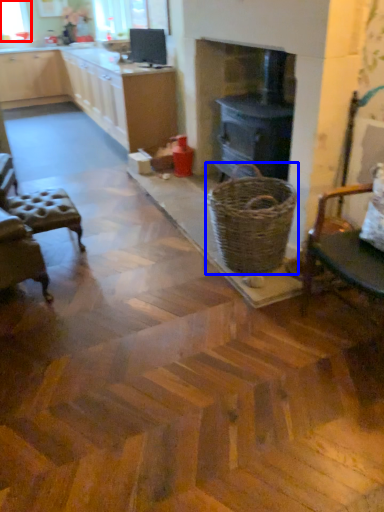
Question: Which of the following is the farthest to the observer, window screen (highlighted by a red box) or basket (highlighted by a blue box)?

Choices:
 (A) window screen
 (B) basket

Answer: (A)